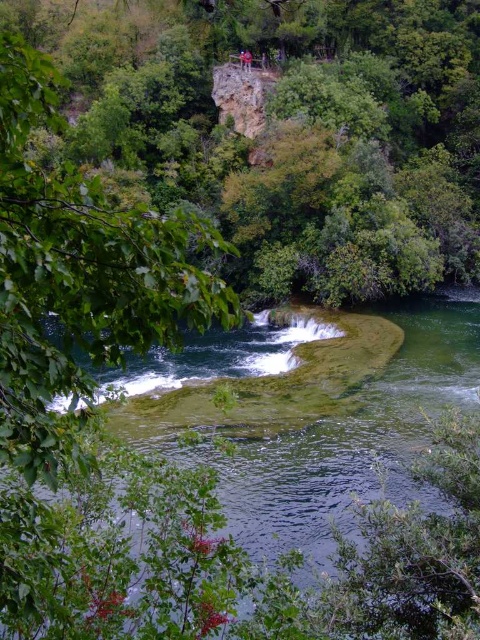
Does clear water at center have a lesser width compared to blue fabric person at upper center?

No.

Can you confirm if clear water at center is positioned below blue fabric person at upper center?

Yes, clear water at center is below blue fabric person at upper center.

Who is more distant from viewer, (355, 609) or (243, 65)?

The point (243, 65) is behind.

Find the location of a particular element. clear water at center is located at coordinates (244, 500).